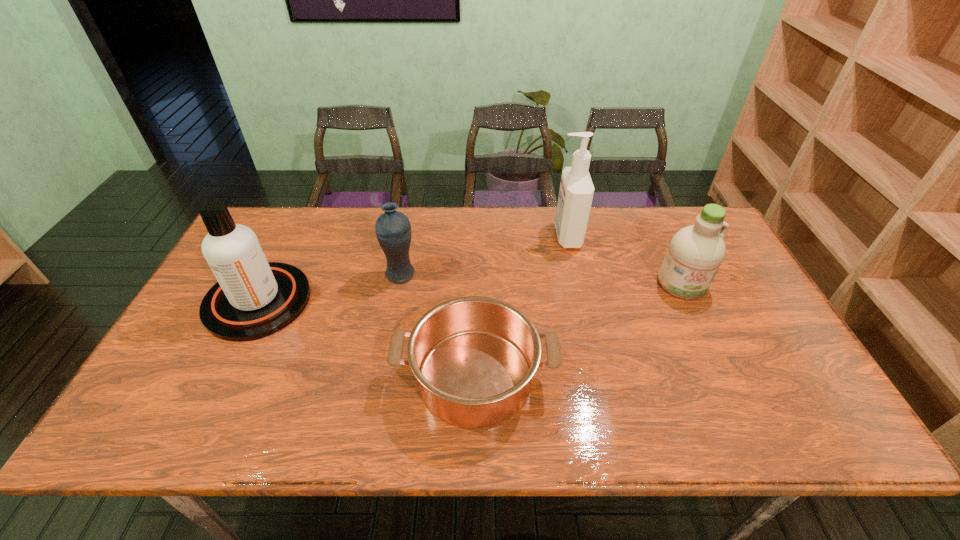
What are the coordinates of `free space located on the right of the leftmost cleansing agent` in the screenshot? It's located at (330, 301).

Locate an element on the screen. This screenshot has width=960, height=540. free point located 0.350m on the front label of the rightmost cleansing agent is located at coordinates (743, 415).

What are the coordinates of `vacant space located 0.180m on the left of the vase` in the screenshot? It's located at (324, 274).

This screenshot has height=540, width=960. What are the coordinates of `vacant space situated 0.390m on the right of the saucepan` in the screenshot? It's located at (717, 376).

This screenshot has width=960, height=540. Find the location of `object that is positioned at the far edge`. object that is positioned at the far edge is located at coordinates (576, 191).

The image size is (960, 540). I want to click on object that is at the near edge, so click(474, 358).

This screenshot has height=540, width=960. I want to click on object positioned at the left edge, so click(x=253, y=298).

This screenshot has width=960, height=540. What are the coordinates of `object that is at the right edge` in the screenshot? It's located at (695, 253).

Locate an element on the screen. Image resolution: width=960 pixels, height=540 pixels. free region at the far edge of the desktop is located at coordinates (631, 226).

The width and height of the screenshot is (960, 540). I want to click on vacant space at the near edge, so click(362, 426).